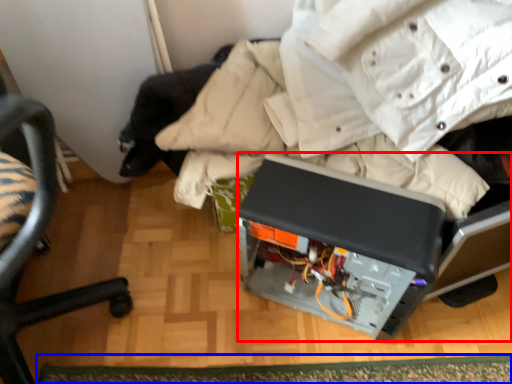
Question: Which object appears farthest to the camera in this image, wide (highlighted by a red box) or mat (highlighted by a blue box)?

Choices:
 (A) wide
 (B) mat

Answer: (B)